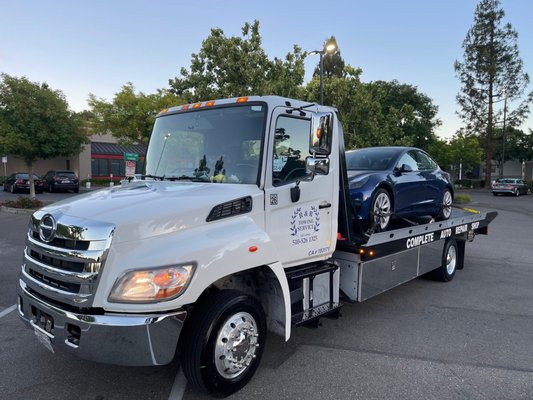
You are a GUI agent. You are given a task and a screenshot of the screen. Output one action in this format:
    pyautogui.click(x=<x>, y=<y>)
    Task: Click on the mirror
    
    Given the screenshot: What is the action you would take?
    pyautogui.click(x=292, y=173)